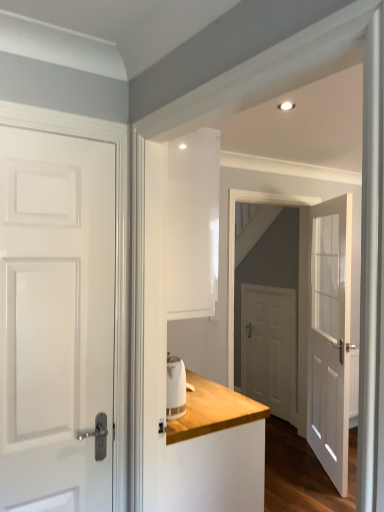
Question: Considering the relative sizes of white glass door at center, the first door when ordered from right to left, and white glossy door at center in the image provided, is white glass door at center, the first door when ordered from right to left, taller than white glossy door at center?

Choices:
 (A) yes
 (B) no

Answer: (B)

Question: Is the surface of white glass door at center, marked as the second door in a front-to-back arrangement, in direct contact with white glossy door at center?

Choices:
 (A) no
 (B) yes

Answer: (B)

Question: Considering the relative sizes of white glass door at center, placed as the 3th door when sorted from left to right, and white glossy door at center in the image provided, is white glass door at center, placed as the 3th door when sorted from left to right, thinner than white glossy door at center?

Choices:
 (A) no
 (B) yes

Answer: (B)

Question: Is white glass door at center, the 2th door from the back, smaller than white glossy door at center?

Choices:
 (A) no
 (B) yes

Answer: (B)

Question: Is white glass door at center, marked as the second door in a front-to-back arrangement, not inside white glossy door at center?

Choices:
 (A) yes
 (B) no

Answer: (A)

Question: From the image's perspective, is white glass door at center, the 2th door from the back, located above or below white matte door at center, which appears as the 3th door when viewed from the front?

Choices:
 (A) above
 (B) below

Answer: (A)

Question: Relative to white matte door at center, which appears as the 3th door when viewed from the front, is white glass door at center, the first door when ordered from right to left, in front or behind?

Choices:
 (A) behind
 (B) front

Answer: (B)

Question: Looking at their shapes, would you say white glass door at center, the 2th door from the back, is wider or thinner than white matte door at center, acting as the 1th door starting from the back?

Choices:
 (A) wide
 (B) thin

Answer: (A)

Question: Considering the positions of white glass door at center, placed as the 3th door when sorted from left to right, and white matte door at center, which appears as the 3th door when viewed from the front, in the image, is white glass door at center, placed as the 3th door when sorted from left to right, taller or shorter than white matte door at center, which appears as the 3th door when viewed from the front,?

Choices:
 (A) short
 (B) tall

Answer: (B)

Question: Is white wood dresser at center bigger or smaller than white glossy kettle at center?

Choices:
 (A) big
 (B) small

Answer: (A)

Question: Considering the positions of white wood dresser at center and white glossy kettle at center in the image, is white wood dresser at center taller or shorter than white glossy kettle at center?

Choices:
 (A) tall
 (B) short

Answer: (A)

Question: Is white wood dresser at center inside the boundaries of white glossy kettle at center, or outside?

Choices:
 (A) outside
 (B) inside

Answer: (A)

Question: From the image's perspective, relative to white glossy kettle at center, is white wood dresser at center above or below?

Choices:
 (A) above
 (B) below

Answer: (B)

Question: Would you say white glossy door at center is inside or outside white glass door at center, the 2th door from the back?

Choices:
 (A) inside
 (B) outside

Answer: (B)

Question: Would you say white glossy door at center is to the left or to the right of white glass door at center, the first door when ordered from right to left, in the picture?

Choices:
 (A) left
 (B) right

Answer: (A)